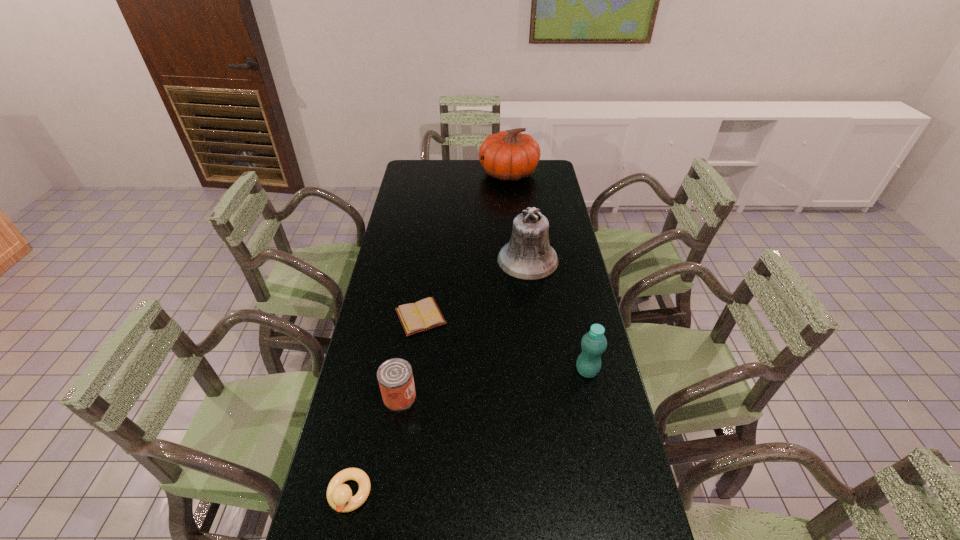
Locate an element on the screen. The image size is (960, 540). pumpkin is located at coordinates coord(509,156).

Identify the location of the fifth nearest object. tap(528, 255).

What are the coordinates of `the third tallest object` in the screenshot? It's located at (593, 343).

This screenshot has width=960, height=540. Identify the location of water bottle. (593, 343).

Image resolution: width=960 pixels, height=540 pixels. What are the coordinates of `the fifth farthest object` in the screenshot? It's located at (395, 377).

Image resolution: width=960 pixels, height=540 pixels. Identify the location of can. (395, 377).

Locate an element on the screen. Image resolution: width=960 pixels, height=540 pixels. the second shortest object is located at coordinates coord(339,495).

Locate an element on the screen. The width and height of the screenshot is (960, 540). duckling is located at coordinates (339, 495).

Where is `diary`? The image size is (960, 540). diary is located at coordinates click(423, 315).

Find the location of a particular element. The image size is (960, 540). the third farthest object is located at coordinates (423, 315).